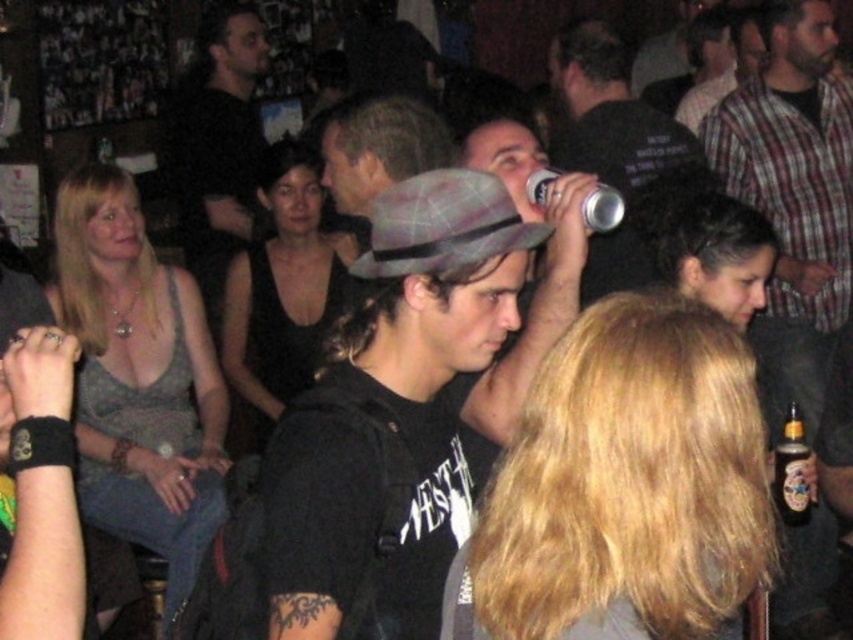
You are a bartender at this bar. A customer asks if the metallic silver can at upper center has a larger volume than the amber glass bottle at lower right. Based on their sizes, how would you respond?

The metallic silver can at upper center is larger in size than the amber glass bottle at lower right, so it likely has a larger volume.

From the picture: You are a photographer at the event and want to capture both the plaid fabric fedora at center and the metallic silver can at upper center in the same frame. Which object should you adjust your camera angle to focus on first to ensure both are in the shot?

The plaid fabric fedora at center has a lesser height compared to metallic silver can at upper center, so you should focus on the metallic silver can at upper center first to ensure both objects are within the frame.

You are a photographer standing in the scene. You want to take a closeup shot of the plaid fabric fedora at center without including any other objects in the frame. Is the distance sufficient for your camera with a 50mm lens? Assume the minimum focusing distance of the lens is 0.5 meters.

The plaid fabric fedora at center is 1.42 meters from viewer, which is greater than the minimum focusing distance of 0.5 meters. Yes, the distance is sufficient for a 50mm lens to capture a closeup without including other objects.